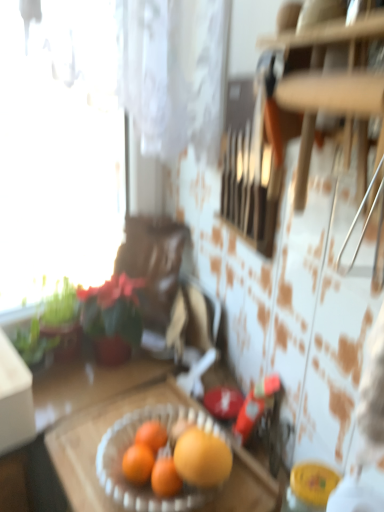
The image size is (384, 512). I want to click on free spot above clear glass bowl at center (from a real-world perspective), so click(x=128, y=410).